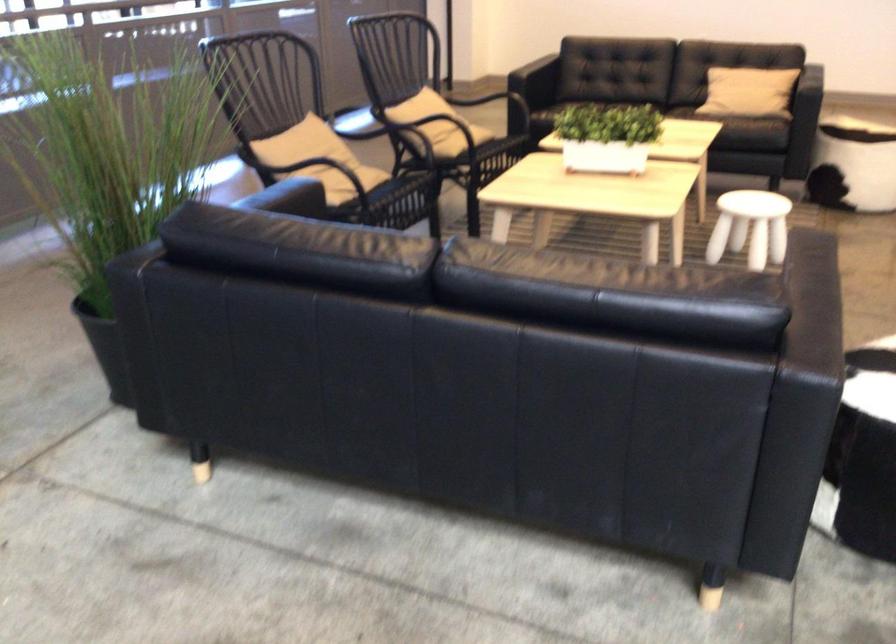
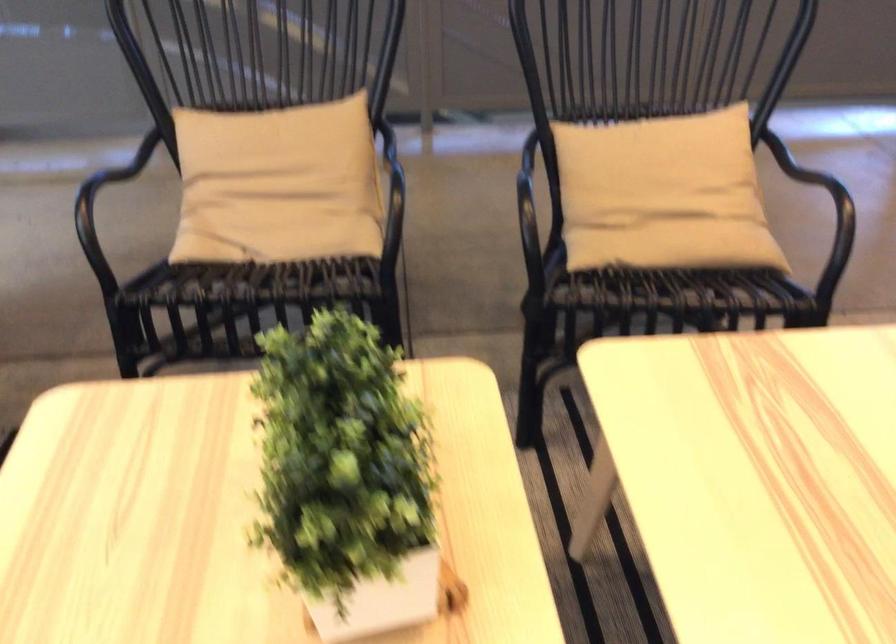
In the second image, find the point that corresponds to (325,160) in the first image.

(278, 184)